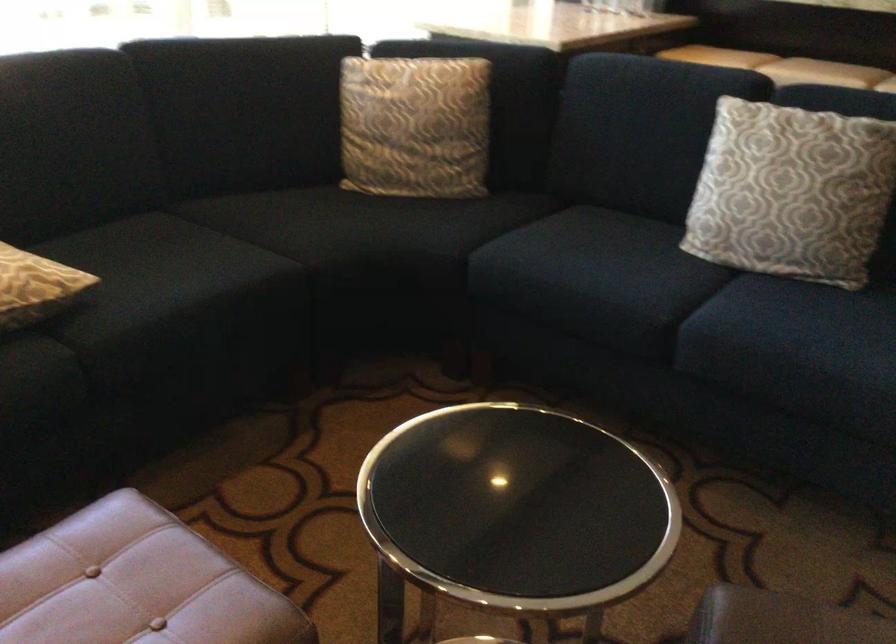
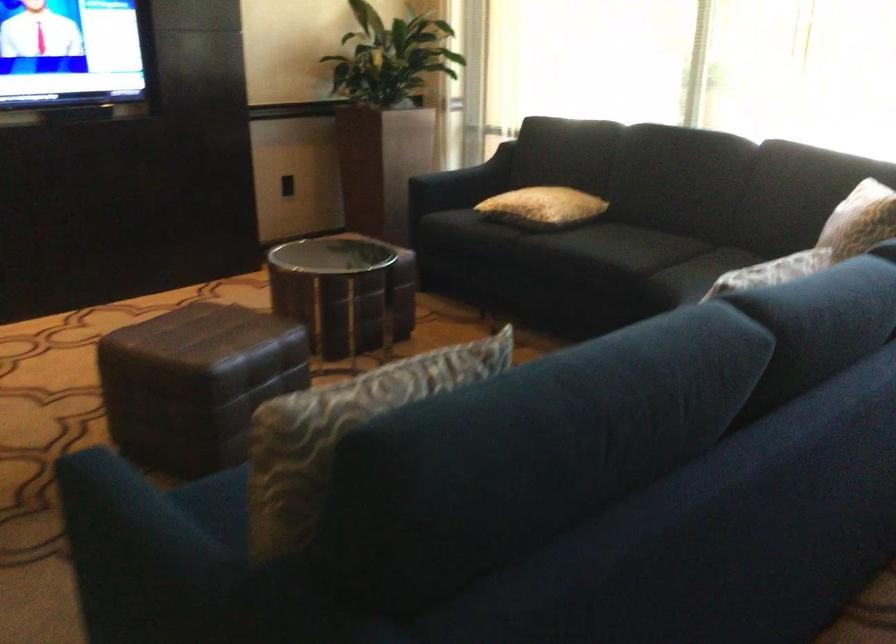
Find the pixel in the second image that matches (263,257) in the first image.

(626, 254)